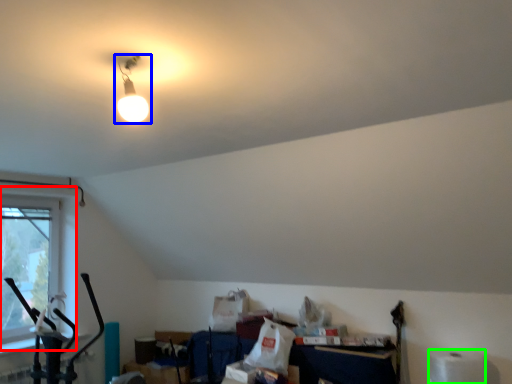
Question: Estimate the real-world distances between objects in this image. Which object is farther from window (highlighted by a red box), lamp (highlighted by a blue box) or toilet paper (highlighted by a green box)?

Choices:
 (A) lamp
 (B) toilet paper

Answer: (B)